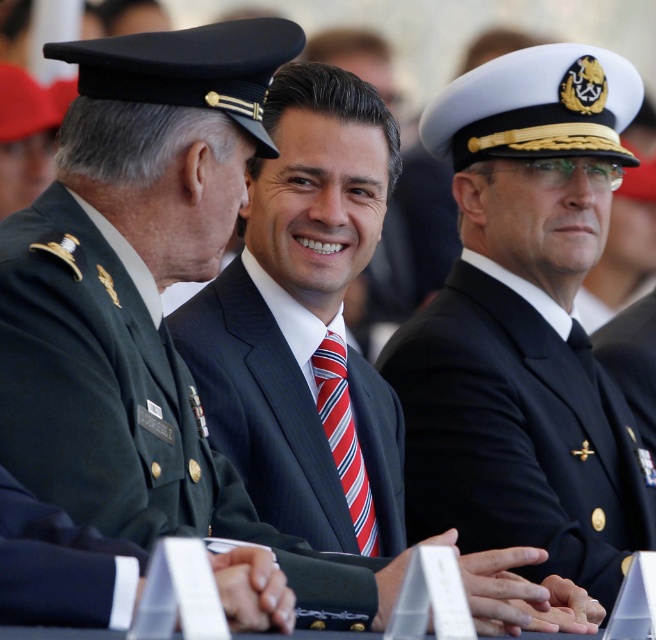
You are a photographer at this event and want to ensure the navy blue fabric suit at center and the red striped tie at center are both visible in your photo. Which one should you focus on to capture the full width of both?

The navy blue fabric suit at center has a lesser width compared to the red striped tie at center, so you should focus on the wider red striped tie at center to ensure both are fully visible.

You are standing at the origin point in the image. There are two points marked in the scene. Which of the two points, point (413, 428) or point (323, 362), is located further away from you?

Point (413, 428) is behind point (323, 362), so it is further away from you.